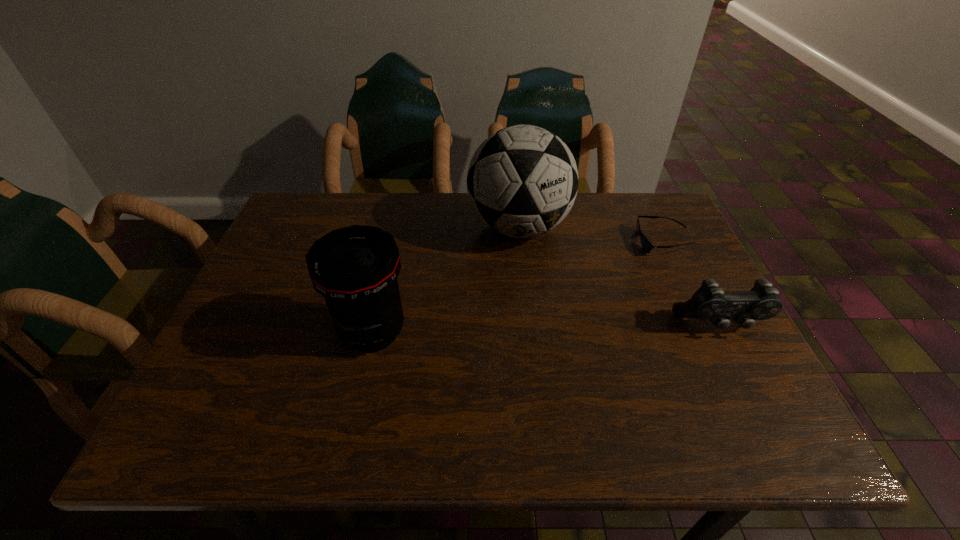
Where is `vacant space at the near edge of the desktop`? The image size is (960, 540). vacant space at the near edge of the desktop is located at coordinates (428, 389).

The height and width of the screenshot is (540, 960). In the image, there is a desktop. Find the location of `free space at the left edge`. free space at the left edge is located at coordinates (260, 281).

Locate an element on the screen. free space at the right edge is located at coordinates (709, 335).

Identify the location of vacant space at the far left corner of the desktop. This screenshot has width=960, height=540. (279, 235).

In the image, there is a desktop. Where is `free space at the near right corner`? The image size is (960, 540). free space at the near right corner is located at coordinates (692, 389).

Locate an element on the screen. This screenshot has height=540, width=960. vacant area between the sunglasses and the second object from left to right is located at coordinates (590, 234).

I want to click on free space between the control and the telephoto lens, so click(x=546, y=328).

You are a GUI agent. You are given a task and a screenshot of the screen. Output one action in this format:
    pyautogui.click(x=<x>, y=<y>)
    Task: Click on the free space between the soccer ball and the control
    The width and height of the screenshot is (960, 540).
    Given the screenshot: What is the action you would take?
    pyautogui.click(x=619, y=276)

Locate an element on the screen. The width and height of the screenshot is (960, 540). free space between the shortest object and the soccer ball is located at coordinates (590, 234).

Identify the location of free space between the control and the soccer ball. (619, 276).